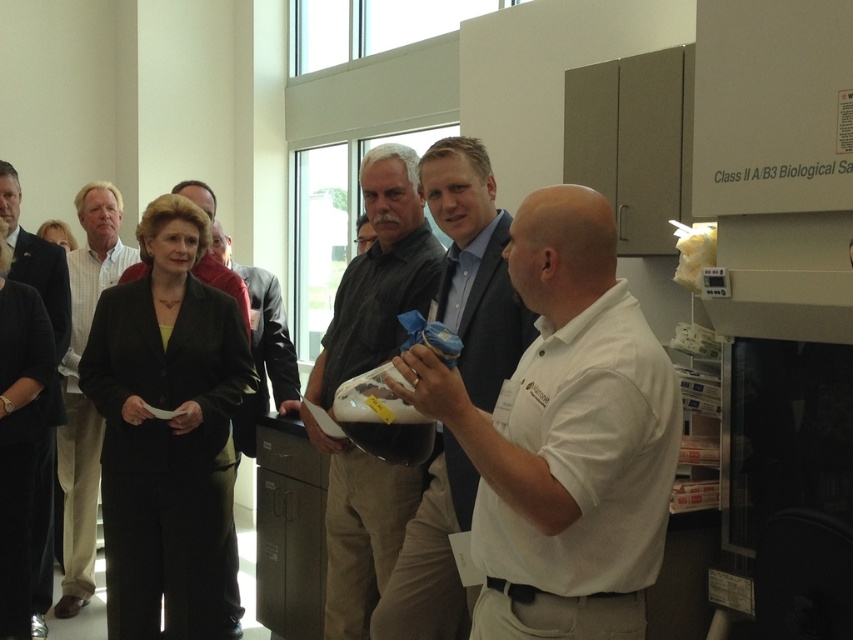
Measure the distance between matte black shirt at center and black fabric suit at center.

matte black shirt at center is 32.19 inches from black fabric suit at center.

Is matte black shirt at center positioned behind black fabric suit at center?

No, it is in front of black fabric suit at center.

Is point (334, 486) closer to camera compared to point (125, 272)?

Yes, point (334, 486) is in front of point (125, 272).

The image size is (853, 640). I want to click on matte black shirt at center, so click(x=379, y=275).

Is matte black shirt at center further to the viewer compared to light brown shirt at center?

No, matte black shirt at center is in front of light brown shirt at center.

Is point (364, 560) more distant than point (80, 298)?

That is False.

Does point (337, 589) come behind point (77, 381)?

No.

In order to click on matte black shirt at center in this screenshot , I will do `click(379, 275)`.

Which is behind, point (395, 330) or point (22, 234)?

Point (22, 234)

Between matte black shirt at center and dark suit jacket at center, which one appears on the left side from the viewer's perspective?

dark suit jacket at center is more to the left.

Which is behind, point (335, 563) or point (38, 595)?

The point (38, 595) is behind.

Locate an element on the screen. matte black shirt at center is located at coordinates (379, 275).